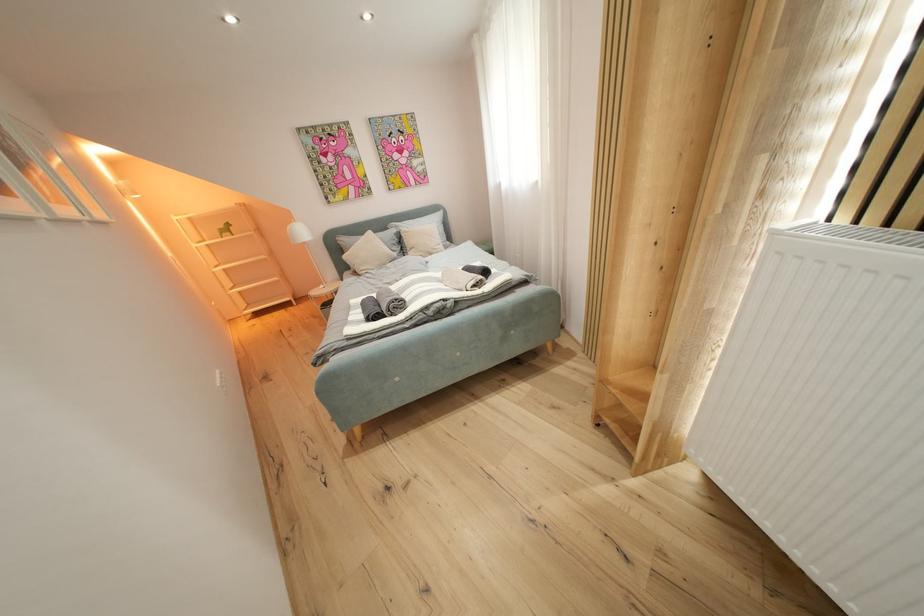
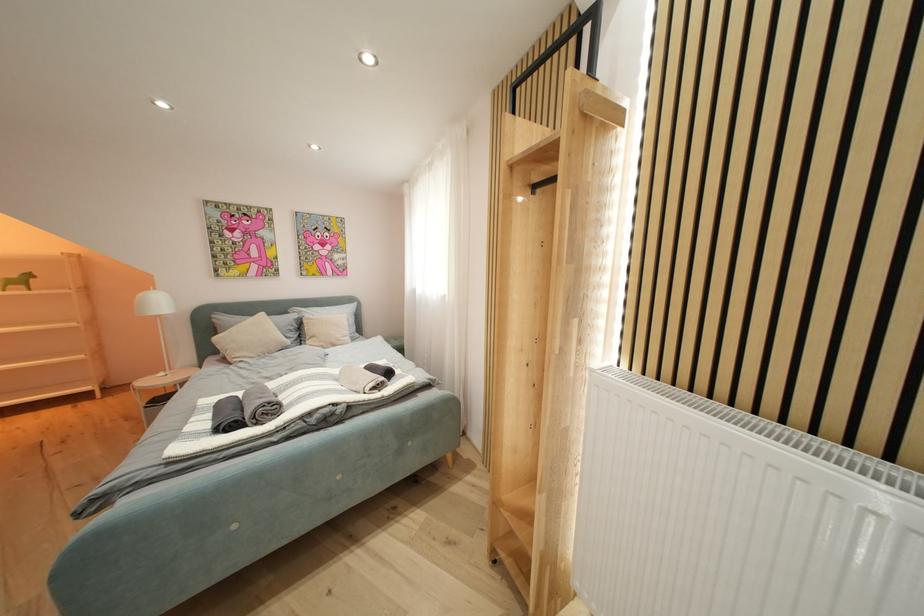
What movement of the cameraman would produce the second image?

The cameraman moved toward right, backward.